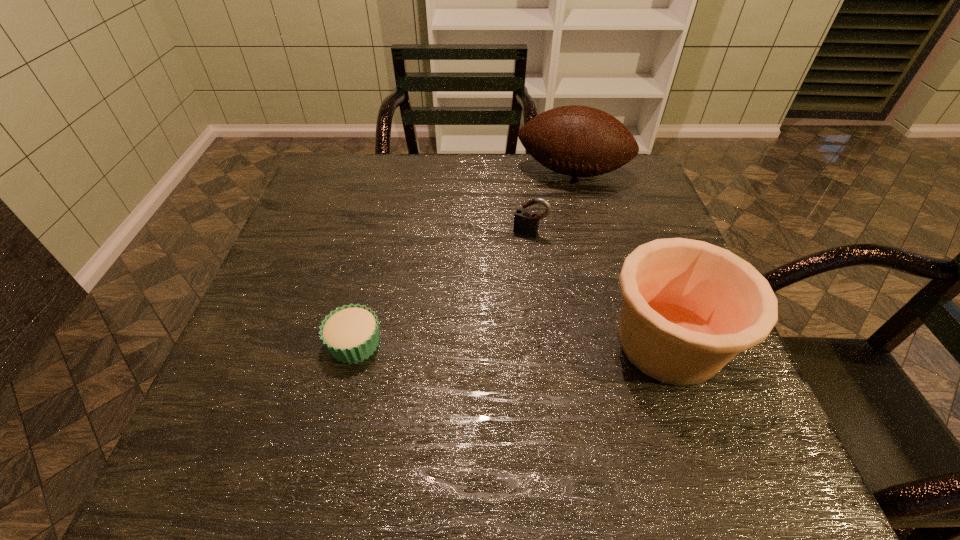
The image size is (960, 540). In order to click on vacant space at the far edge of the desktop in this screenshot , I will do `click(561, 198)`.

Identify the location of free space at the near edge of the desktop. (483, 384).

In the image, there is a desktop. Where is `vacant space at the left edge`? Image resolution: width=960 pixels, height=540 pixels. vacant space at the left edge is located at coordinates (317, 233).

Image resolution: width=960 pixels, height=540 pixels. I want to click on free space at the right edge, so click(649, 227).

In the image, there is a desktop. Where is `vacant space at the far left corner`? The image size is (960, 540). vacant space at the far left corner is located at coordinates (355, 158).

This screenshot has height=540, width=960. In order to click on vacant region at the far right corner of the desktop in this screenshot , I will do `click(606, 176)`.

The image size is (960, 540). I want to click on vacant area at the near right corner of the desktop, so click(x=670, y=422).

You are a GUI agent. You are given a task and a screenshot of the screen. Output one action in this format:
    pyautogui.click(x=<x>, y=<y>)
    Task: Click on the empty location between the second tallest object and the farthest object
    This screenshot has width=960, height=540.
    Given the screenshot: What is the action you would take?
    pyautogui.click(x=620, y=258)

Identify the location of free space between the third shortest object and the padlock. The width and height of the screenshot is (960, 540). (599, 288).

This screenshot has width=960, height=540. Identify the location of vacant space that is in between the shortest object and the padlock. (443, 288).